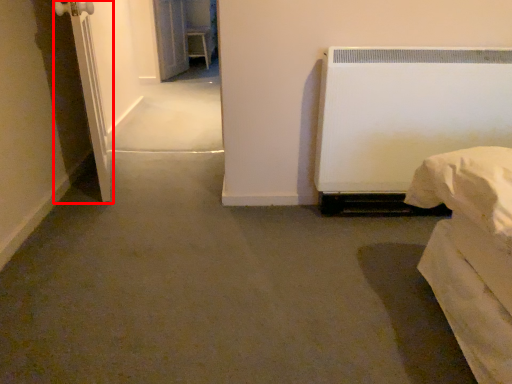
Question: From the image's perspective, what is the correct spatial positioning of screen door (annotated by the red box) in reference to screen door?

Choices:
 (A) above
 (B) below

Answer: (B)